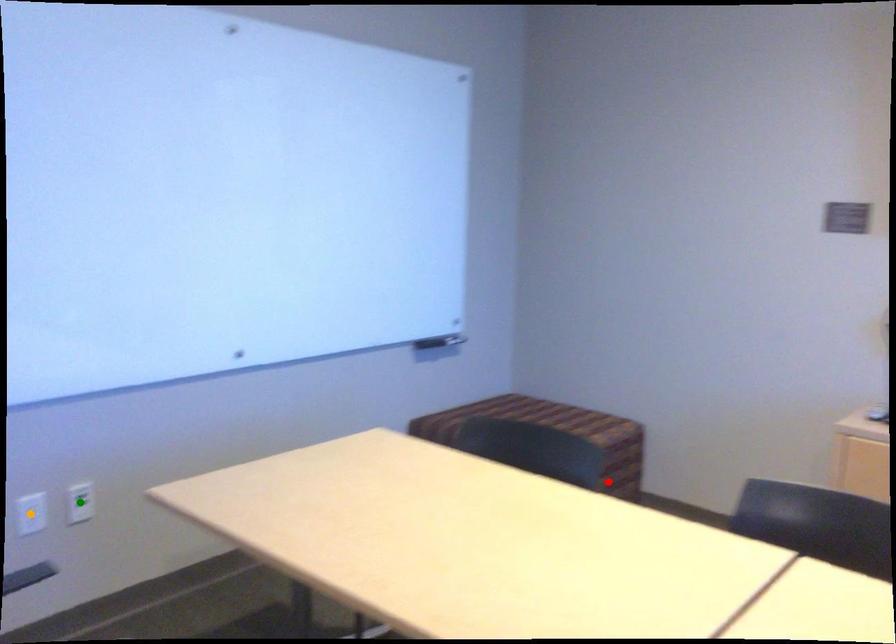
Order these from nearest to farthest:
green point | red point | orange point

1. orange point
2. green point
3. red point